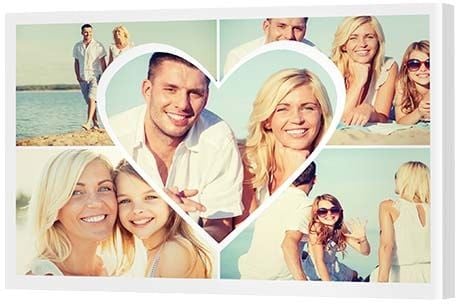
Image resolution: width=460 pixels, height=304 pixels. Find the location of `pictures`. pictures is located at coordinates (90, 251), (309, 246), (373, 87), (231, 135), (60, 70).